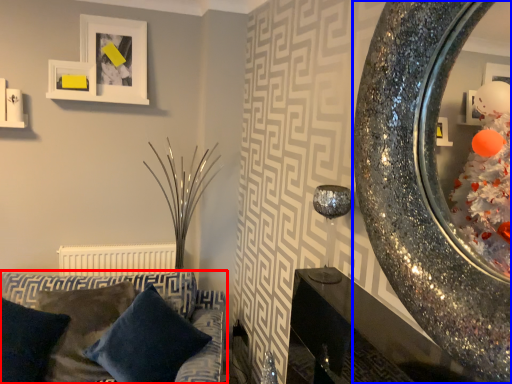
Question: Which of the following is the farthest to the observer, studio couch (highlighted by a red box) or mirror (highlighted by a blue box)?

Choices:
 (A) studio couch
 (B) mirror

Answer: (A)